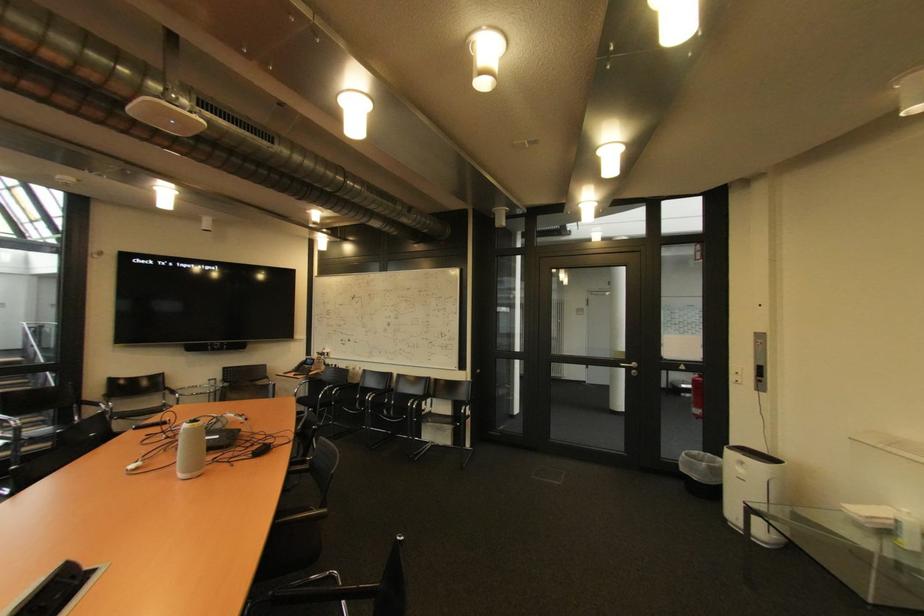
What do you see at coordinates (629, 368) in the screenshot? Image resolution: width=924 pixels, height=616 pixels. I see `the silver door handle` at bounding box center [629, 368].